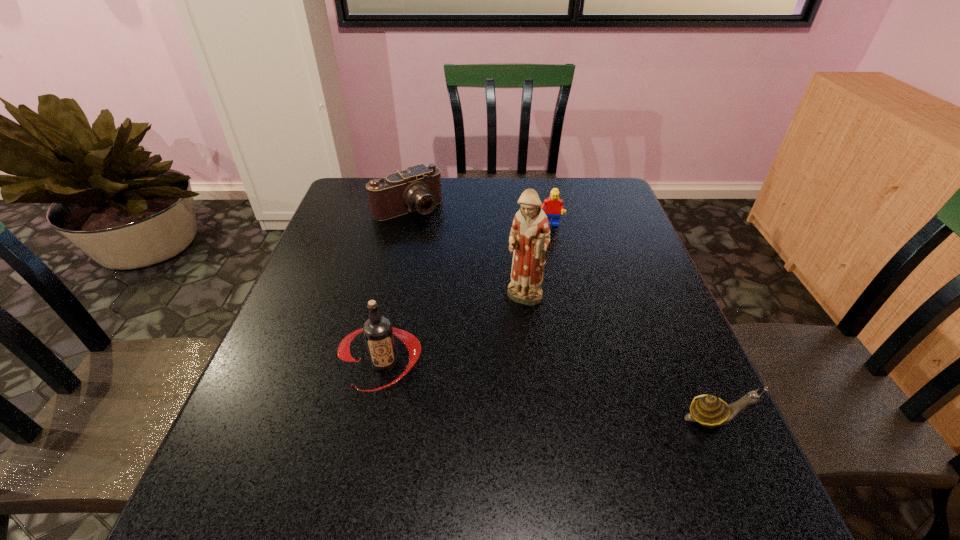
This screenshot has width=960, height=540. What are the coordinates of `empty space between the rightmost object and the camera` in the screenshot? It's located at (562, 313).

Where is `empty space that is in between the tallest object and the camera`? This screenshot has height=540, width=960. empty space that is in between the tallest object and the camera is located at coordinates (467, 255).

You are a GUI agent. You are given a task and a screenshot of the screen. Output one action in this format:
    pyautogui.click(x=<x>, y=<y>)
    Task: Click on the free spot between the nearest object and the root beer
    
    Given the screenshot: What is the action you would take?
    pyautogui.click(x=550, y=390)

Locate an element on the screen. The height and width of the screenshot is (540, 960). free spot between the camera and the Lego is located at coordinates (478, 217).

Identify the location of vacant area that lies between the rightmost object and the figurine. This screenshot has width=960, height=540. (620, 359).

The height and width of the screenshot is (540, 960). I want to click on free space between the rightmost object and the second tallest object, so click(550, 390).

The height and width of the screenshot is (540, 960). Identify the location of free space between the camera and the figurine. (467, 255).

Where is `blank region between the camera and the second tallest object`? blank region between the camera and the second tallest object is located at coordinates (396, 286).

Point out which object is positioned as the third nearest to the camera. Please provide its 2D coordinates. Your answer should be formatted as a tuple, i.e. [(x, y)], where the tuple contains the x and y coordinates of a point satisfying the conditions above.

[(378, 332)]

At what (x,y) coordinates should I click in order to perform the action: click on object identified as the third closest to the third object from left to right. Please return your answer as a coordinate pair (x, y). This screenshot has width=960, height=540. Looking at the image, I should click on (710, 411).